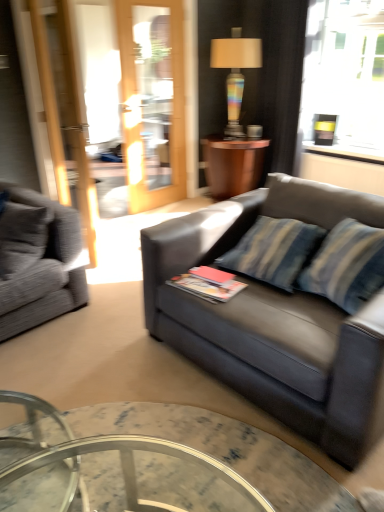
Question: Is wooden side table at center in front of slate gray leather couch at center, which is the 1th studio couch in right-to-left order?

Choices:
 (A) no
 (B) yes

Answer: (A)

Question: Does wooden side table at center have a larger size compared to slate gray leather couch at center, which is the 1th studio couch in right-to-left order?

Choices:
 (A) no
 (B) yes

Answer: (A)

Question: Could you tell me if wooden side table at center is facing slate gray leather couch at center, which is the 1th studio couch in right-to-left order?

Choices:
 (A) no
 (B) yes

Answer: (A)

Question: Considering the relative sizes of wooden side table at center and slate gray leather couch at center, which is counted as the 2th studio couch, starting from the left, in the image provided, is wooden side table at center wider than slate gray leather couch at center, which is counted as the 2th studio couch, starting from the left,?

Choices:
 (A) no
 (B) yes

Answer: (A)

Question: Is wooden side table at center with slate gray leather couch at center, which is counted as the 2th studio couch, starting from the left?

Choices:
 (A) yes
 (B) no

Answer: (B)

Question: From the image's perspective, does wooden side table at center appear lower than slate gray leather couch at center, which is the 1th studio couch in right-to-left order?

Choices:
 (A) no
 (B) yes

Answer: (A)

Question: Is gray fabric couch at left, the 1th studio couch viewed from the left, looking in the opposite direction of slate gray leather couch at center, which is counted as the 2th studio couch, starting from the left?

Choices:
 (A) no
 (B) yes

Answer: (A)

Question: Is gray fabric couch at left, the 1th studio couch viewed from the left, not within slate gray leather couch at center, which is counted as the 2th studio couch, starting from the left?

Choices:
 (A) no
 (B) yes

Answer: (B)

Question: Does gray fabric couch at left, marked as the second studio couch in a right-to-left arrangement, have a larger size compared to slate gray leather couch at center, which is counted as the 2th studio couch, starting from the left?

Choices:
 (A) yes
 (B) no

Answer: (B)

Question: Is gray fabric couch at left, marked as the second studio couch in a right-to-left arrangement, with slate gray leather couch at center, which is the 1th studio couch in right-to-left order?

Choices:
 (A) yes
 (B) no

Answer: (B)

Question: Can you confirm if gray fabric couch at left, marked as the second studio couch in a right-to-left arrangement, is shorter than slate gray leather couch at center, which is the 1th studio couch in right-to-left order?

Choices:
 (A) no
 (B) yes

Answer: (B)

Question: From a real-world perspective, is gray fabric couch at left, marked as the second studio couch in a right-to-left arrangement, physically above slate gray leather couch at center, which is the 1th studio couch in right-to-left order?

Choices:
 (A) no
 (B) yes

Answer: (B)

Question: From the image's perspective, would you say rainbow glass lamp at upper center is shown under wooden side table at center?

Choices:
 (A) no
 (B) yes

Answer: (A)